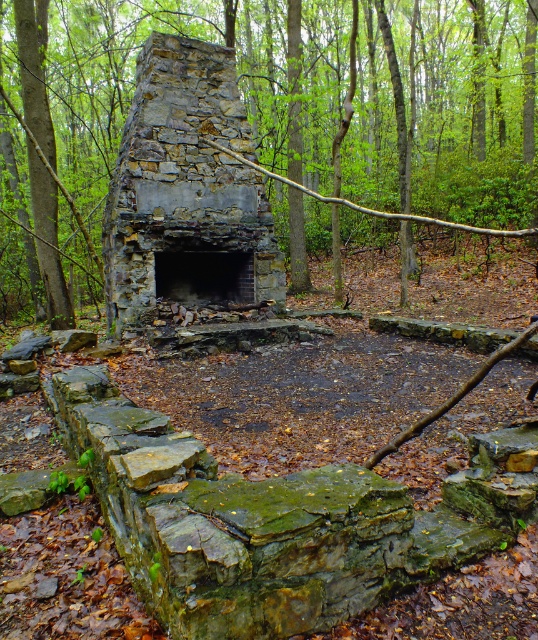
Is green mossy stone chimney at center to the left of dark gray stone fireplace at center from the viewer's perspective?

Incorrect, green mossy stone chimney at center is not on the left side of dark gray stone fireplace at center.

Measure the distance between green mossy stone chimney at center and dark gray stone fireplace at center.

green mossy stone chimney at center is 10.60 meters away from dark gray stone fireplace at center.

Is point (10, 316) positioned behind point (225, 296)?

Yes, point (10, 316) is behind point (225, 296).

The image size is (538, 640). Identify the location of green mossy stone chimney at center. (444, 109).

Measure the distance between point (286, 224) and camera.

Point (286, 224) and camera are 18.06 meters apart.

Does point (70, 22) come behind point (173, 200)?

Yes, it is behind point (173, 200).

Find the location of a particular element. green mossy stone chimney at center is located at coordinates (444, 109).

Does rustic stone fireplace at center have a greater width compared to dark gray stone fireplace at center?

Yes, rustic stone fireplace at center is wider than dark gray stone fireplace at center.

Does rustic stone fireplace at center appear on the left side of dark gray stone fireplace at center?

No, rustic stone fireplace at center is not to the left of dark gray stone fireplace at center.

Locate an element on the screen. rustic stone fireplace at center is located at coordinates (186, 192).